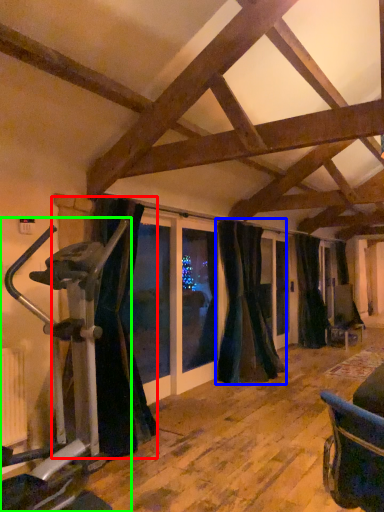
Question: Based on their relative distances, which object is nearer to curtain (highlighted by a red box)? Choose from curtain (highlighted by a blue box) and stationary bicycle (highlighted by a green box).

Choices:
 (A) curtain
 (B) stationary bicycle

Answer: (B)